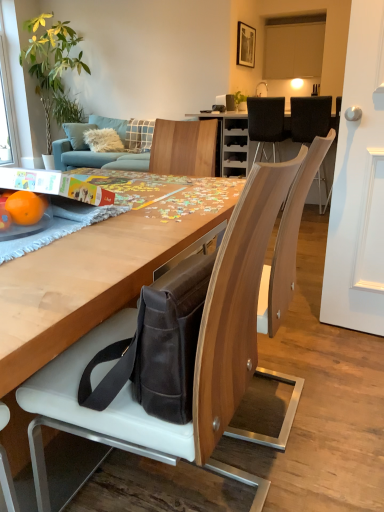
Question: From a real-world perspective, is transparent glass window screen at upper left above or below leather bag at lower center, which ranks as the 1th chair in bottom-to-top order?

Choices:
 (A) below
 (B) above

Answer: (B)

Question: Considering the positions of transparent glass window screen at upper left and leather bag at lower center, the first chair in the left-to-right sequence, in the image, is transparent glass window screen at upper left wider or thinner than leather bag at lower center, the first chair in the left-to-right sequence,?

Choices:
 (A) thin
 (B) wide

Answer: (A)

Question: Which object is the closest to the orangesmoothfruit at left?

Choices:
 (A) black leather chair at upper center, positioned as the 1th chair in top-to-bottom order
 (B) black leather chair at upper right, which ranks as the second chair in back-to-front order
 (C) leather bag at lower center, acting as the third chair starting from the top
 (D) green leafy plant at upper left
 (E) dark brown leather messenger bag at center

Answer: (E)

Question: Based on their relative distances, which object is nearer to the dark brown leather messenger bag at center?

Choices:
 (A) green leafy plant at upper left
 (B) black leather chair at upper right, arranged as the second chair when ordered from the bottom
 (C) leather bag at lower center, which ranks as the 1th chair in bottom-to-top order
 (D) black leather chair at upper center, the first chair positioned from the back
 (E) transparent glass window screen at upper left

Answer: (C)